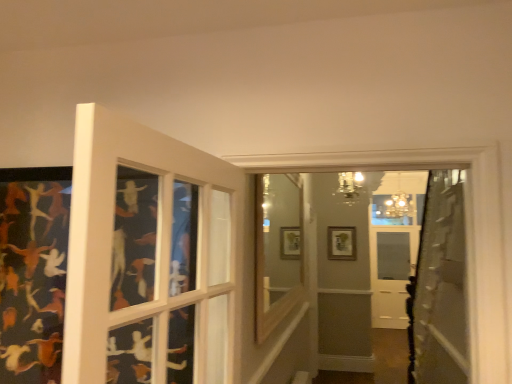
Question: Can you confirm if metallic chandelier at upper center, which is the second light fixture in right-to-left order, is thinner than matte gold chandelier at upper center, which appears as the first light fixture when viewed from the back?

Choices:
 (A) yes
 (B) no

Answer: (A)

Question: Is metallic chandelier at upper center, which is the second light fixture in right-to-left order, at the right side of matte gold chandelier at upper center, which appears as the first light fixture when viewed from the back?

Choices:
 (A) yes
 (B) no

Answer: (B)

Question: From a real-world perspective, is metallic chandelier at upper center, which ranks as the 1th light fixture in left-to-right order, positioned under matte gold chandelier at upper center, which is the 2th light fixture from front to back, based on gravity?

Choices:
 (A) no
 (B) yes

Answer: (B)

Question: Is metallic chandelier at upper center, the 1th light fixture when ordered from front to back, smaller than matte gold chandelier at upper center, the first light fixture from the right?

Choices:
 (A) yes
 (B) no

Answer: (A)

Question: Is metallic chandelier at upper center, the second light fixture when ordered from back to front, beside matte gold chandelier at upper center, which is the 2th light fixture from front to back?

Choices:
 (A) no
 (B) yes

Answer: (A)

Question: Is metallic chandelier at upper center, which ranks as the 1th light fixture in left-to-right order, oriented towards matte gold chandelier at upper center, which is the 2th light fixture from front to back?

Choices:
 (A) yes
 (B) no

Answer: (B)

Question: From the image's perspective, is matte gold chandelier at upper center, the first light fixture from the right, under wooden window frame at center?

Choices:
 (A) yes
 (B) no

Answer: (B)

Question: Does matte gold chandelier at upper center, which appears as the first light fixture when viewed from the back, have a greater width compared to wooden window frame at center?

Choices:
 (A) yes
 (B) no

Answer: (A)

Question: Is wooden window frame at center at the back of matte gold chandelier at upper center, which is the 2th light fixture from front to back?

Choices:
 (A) no
 (B) yes

Answer: (A)

Question: Is matte gold chandelier at upper center, which appears as the first light fixture when viewed from the back, to the right of wooden window frame at center from the viewer's perspective?

Choices:
 (A) no
 (B) yes

Answer: (B)

Question: Are matte gold chandelier at upper center, which ranks as the 2th light fixture in left-to-right order, and wooden window frame at center making contact?

Choices:
 (A) yes
 (B) no

Answer: (B)

Question: Could you tell me if matte gold chandelier at upper center, the first light fixture from the right, is facing wooden window frame at center?

Choices:
 (A) yes
 (B) no

Answer: (A)

Question: Is metallic chandelier at upper center, the 1th light fixture when ordered from front to back, looking in the opposite direction of wooden picture frame at center?

Choices:
 (A) no
 (B) yes

Answer: (B)